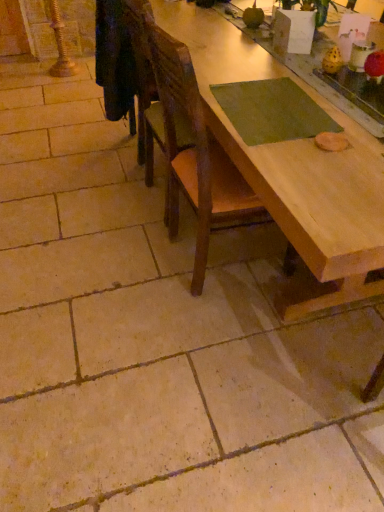
What is the approximate height of natural wood table at center?

31.30 inches.

What do you see at coordinates (294, 169) in the screenshot? I see `natural wood table at center` at bounding box center [294, 169].

Identify the location of natural wood table at center. This screenshot has height=512, width=384. (294, 169).

Measure the distance between point (x=305, y=309) and camera.

5.60 feet.

What do you see at coordinates (194, 152) in the screenshot? The image size is (384, 512). I see `wooden chair at center` at bounding box center [194, 152].

What is the approximate width of wooden chair at center?

It is 21.09 inches.

What are the coordinates of `wooden chair at center` in the screenshot? It's located at pos(194,152).

This screenshot has width=384, height=512. I want to click on natural wood table at center, so click(294, 169).

Which object is positioned more to the left, natural wood table at center or wooden chair at center?

wooden chair at center.

Which is in front, natural wood table at center or wooden chair at center?

natural wood table at center.

Is point (303, 152) less distant than point (199, 196)?

Yes, it is.

From the image's perspective, which one is positioned higher, natural wood table at center or wooden chair at center?

From the image's view, natural wood table at center is above.

From a real-world perspective, who is located lower, natural wood table at center or wooden chair at center?

From a 3D spatial view, natural wood table at center is below.

Considering the relative sizes of natural wood table at center and wooden chair at center in the image provided, is natural wood table at center thinner than wooden chair at center?

No.

Between natural wood table at center and wooden chair at center, which one has less height?

natural wood table at center.

Considering the relative sizes of natural wood table at center and wooden chair at center in the image provided, is natural wood table at center bigger than wooden chair at center?

Indeed, natural wood table at center has a larger size compared to wooden chair at center.

Can we say natural wood table at center lies outside wooden chair at center?

That's correct, natural wood table at center is outside of wooden chair at center.

Is natural wood table at center positioned far away from wooden chair at center?

That's not correct — natural wood table at center is a little close to wooden chair at center.

Is natural wood table at center looking in the opposite direction of wooden chair at center?

natural wood table at center does not have its back to wooden chair at center.

How different are the orientations of natural wood table at center and wooden chair at center in degrees?

The angle between the facing direction of natural wood table at center and the facing direction of wooden chair at center is 90.5 degrees.

Image resolution: width=384 pixels, height=512 pixels. What are the coordinates of `chair below the natural wood table at center (from the image's perspective)` in the screenshot? It's located at (194, 152).

Which is more to the left, wooden chair at center or natural wood table at center?

wooden chair at center is more to the left.

Which object is further away from the camera, wooden chair at center or natural wood table at center?

wooden chair at center is further away from the camera.

Does point (194, 115) appear closer or farther from the camera than point (209, 55)?

Point (194, 115) is positioned closer to the camera compared to point (209, 55).

From the image's perspective, is wooden chair at center over natural wood table at center?

No, from the image's perspective, wooden chair at center is not over natural wood table at center.

From a real-world perspective, who is located higher, wooden chair at center or natural wood table at center?

In real-world perspective, wooden chair at center is above.

Which of these two, wooden chair at center or natural wood table at center, is thinner?

wooden chair at center.

Which of these two, wooden chair at center or natural wood table at center, stands shorter?

With less height is natural wood table at center.

Considering the sizes of objects wooden chair at center and natural wood table at center in the image provided, who is smaller, wooden chair at center or natural wood table at center?

wooden chair at center is smaller.

Is wooden chair at center positioned beyond the bounds of natural wood table at center?

No, most part of wooden chair at center lies within natural wood table at center.

Is there a large distance between wooden chair at center and natural wood table at center?

No, wooden chair at center is not far from natural wood table at center.

Is wooden chair at center positioned with its back to natural wood table at center?

Yes.

Can you tell me how much wooden chair at center and natural wood table at center differ in facing direction?

There is a 90.5-degree angle between the facing directions of wooden chair at center and natural wood table at center.

Measure the distance between wooden chair at center and natural wood table at center.

wooden chair at center and natural wood table at center are 11.66 inches apart from each other.

Where is `chair behind the natural wood table at center`? The height and width of the screenshot is (512, 384). chair behind the natural wood table at center is located at coordinates (194, 152).

Identify the location of table lying in front of the wooden chair at center. Image resolution: width=384 pixels, height=512 pixels. (294, 169).

At what (x,y) coordinates should I click in order to perform the action: click on chair on the left of the natural wood table at center. Please return your answer as a coordinate pair (x, y). This screenshot has width=384, height=512. Looking at the image, I should click on (194, 152).